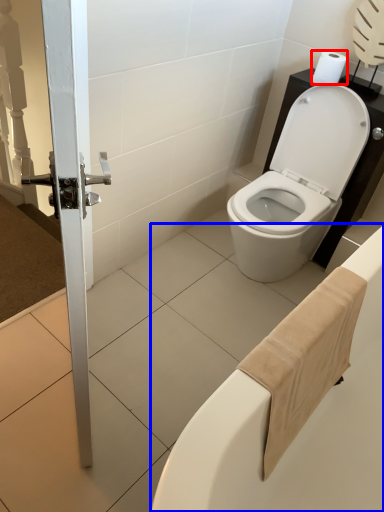
Question: Among these objects, which one is farthest to the camera, toilet paper (highlighted by a red box) or bath (highlighted by a blue box)?

Choices:
 (A) toilet paper
 (B) bath

Answer: (A)